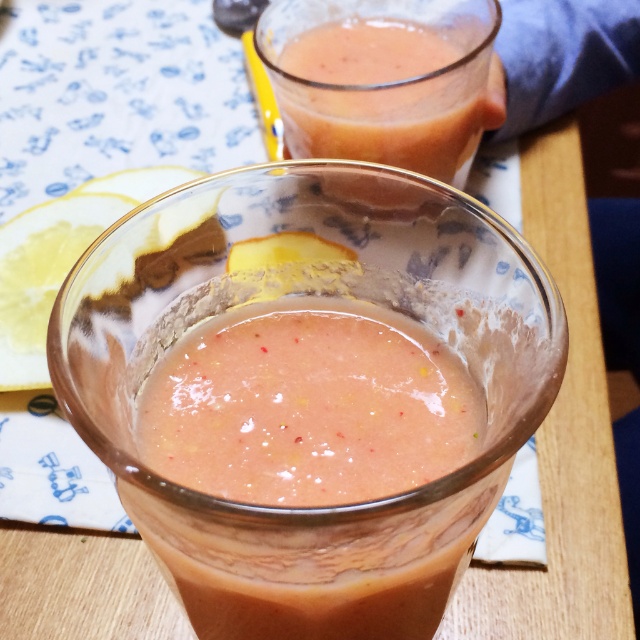
Can you confirm if pink frothy smoothie at center is thinner than pink translucent glass at upper center?

Indeed, pink frothy smoothie at center has a lesser width compared to pink translucent glass at upper center.

Locate an element on the screen. pink frothy smoothie at center is located at coordinates (320, 563).

Between point (260, 545) and point (316, 12), which one is positioned in front?

Positioned in front is point (260, 545).

This screenshot has width=640, height=640. Identify the location of pink frothy smoothie at center. (320, 563).